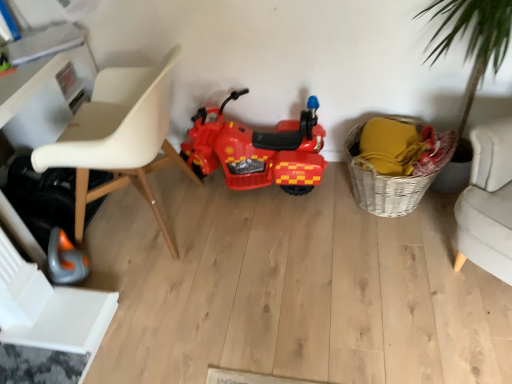
Locate an element on the screen. The image size is (512, 384). vacant area that lies between woven basket at lower right and white plastic swivel chair at lower left is located at coordinates (256, 262).